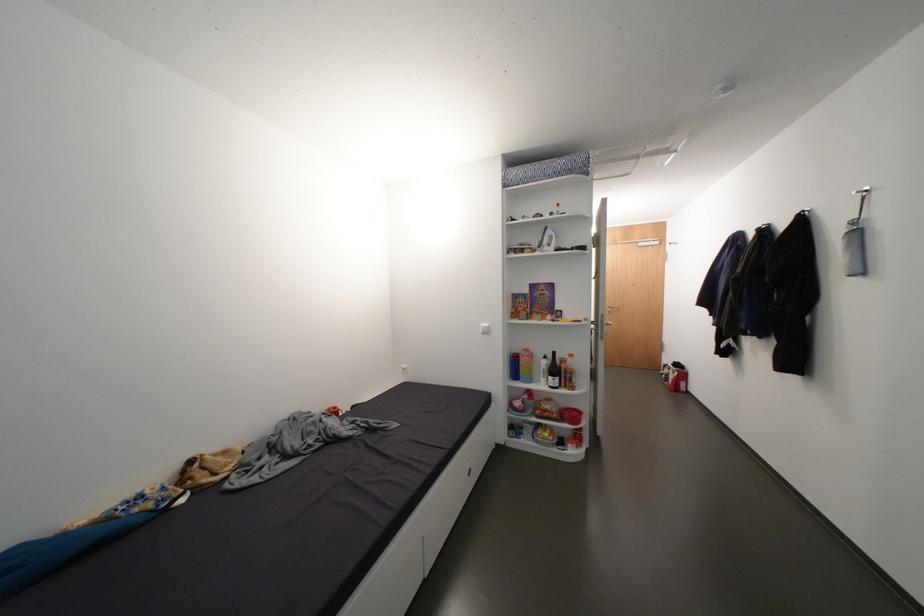
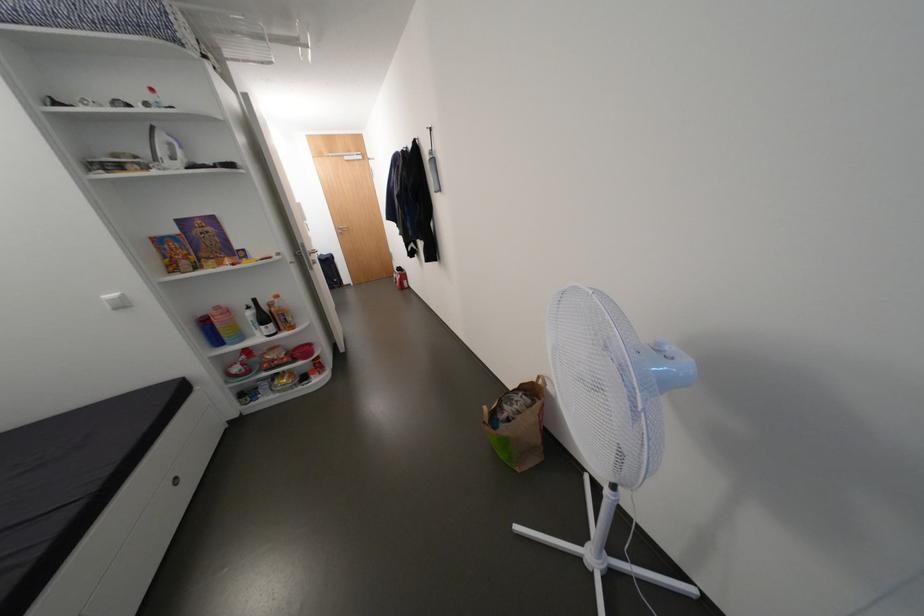
The point at (x=616, y=310) is marked in the first image. Where is the corresponding point in the second image?

(348, 233)